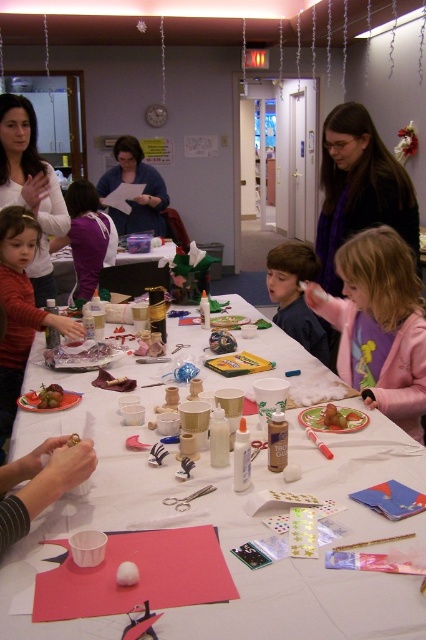
You are standing at the position of the viewer. There is a matte white sweater at upper left on the table. If you want to reach it, can you grab it without moving your feet?

The matte white sweater at upper left is 2.44 meters away from the viewer, which is too far to reach without moving your feet.

You are standing at the door leading outside and want to reach both the point at (356, 280) and the point at (336, 202) on the table. Which point do you need to walk towards first to reach them in the correct order?

You should walk towards point (356, 280) first because it is in front of point (336, 202), so you can reach it before the other point when moving forward from the door.